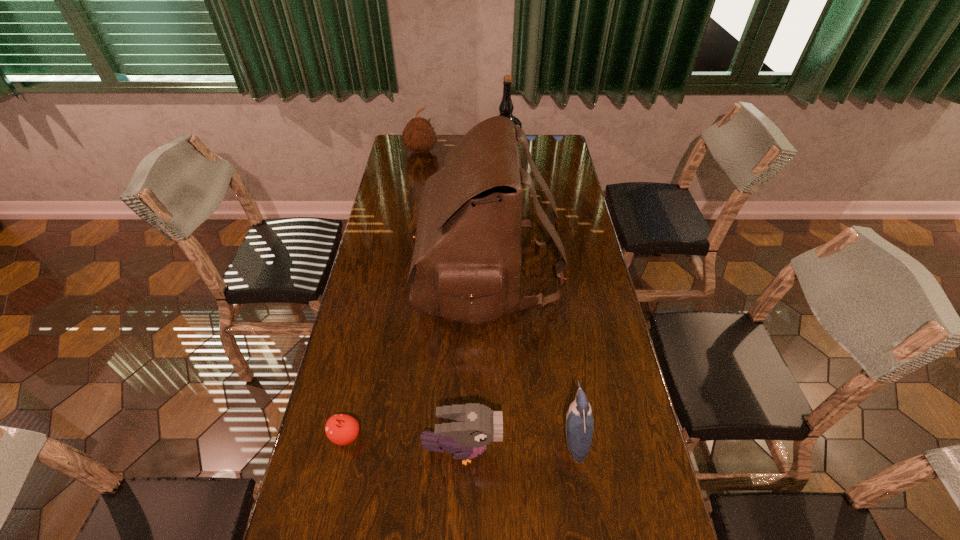
The height and width of the screenshot is (540, 960). Find the location of `object that stands as the fifth closest to the shortest object`. object that stands as the fifth closest to the shortest object is located at coordinates (419, 136).

At what (x,y) coordinates should I click in order to perform the action: click on object that ranks as the fourth closest to the fifth shortest object. Please return your answer as a coordinate pair (x, y). This screenshot has height=540, width=960. Looking at the image, I should click on (475, 426).

The image size is (960, 540). In order to click on free space that satisfies the following two spatial constraints: 1. on the front side of the wine bottle; 2. at the beak of the left bird in this screenshot , I will do `click(524, 450)`.

Image resolution: width=960 pixels, height=540 pixels. I want to click on vacant space that satisfies the following two spatial constraints: 1. on the back side of the wine bottle; 2. on the left side of the shortest object, so click(405, 164).

I want to click on vacant space that satisfies the following two spatial constraints: 1. on the surface of the fourth shortest object; 2. on the right side of the fifth shortest object, so click(419, 164).